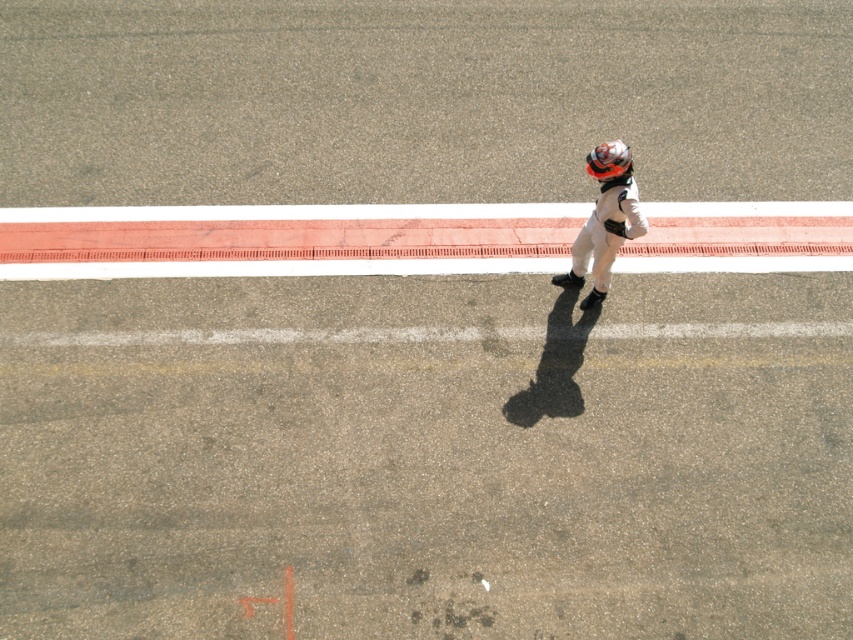
Question: Does white smooth line at center appear on the right side of shiny orange helmet at upper right?

Choices:
 (A) no
 (B) yes

Answer: (A)

Question: Can you confirm if white smooth line at center is smaller than shiny orange helmet at upper right?

Choices:
 (A) no
 (B) yes

Answer: (A)

Question: Can you confirm if white smooth line at center is thinner than shiny orange helmet at upper right?

Choices:
 (A) yes
 (B) no

Answer: (B)

Question: Which object is farther from the camera taking this photo?

Choices:
 (A) white smooth line at center
 (B) shiny orange helmet at upper right

Answer: (A)